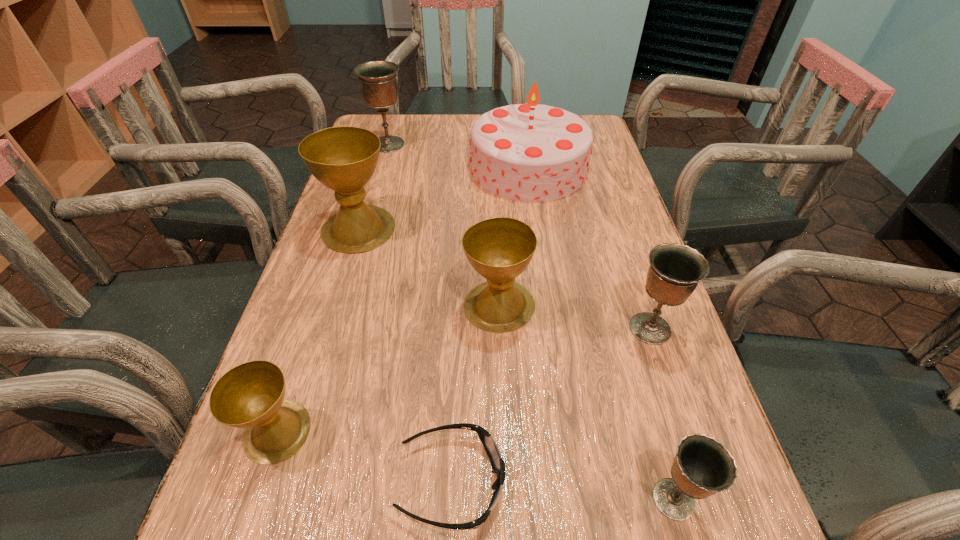
You are a GUI agent. You are given a task and a screenshot of the screen. Output one action in this format:
    pyautogui.click(x=<x>, y=<y>)
    Task: Click on the vacant point located between the sunglasses and the sixth nearest object
    
    Given the screenshot: What is the action you would take?
    pyautogui.click(x=405, y=355)

The width and height of the screenshot is (960, 540). Find the location of `free space between the biggest bronze chalice and the sunglasses`. free space between the biggest bronze chalice and the sunglasses is located at coordinates (420, 313).

Find the location of a particular element. The image size is (960, 540). free space between the birthday cake and the sixth nearest object is located at coordinates (444, 198).

You are a GUI agent. You are given a task and a screenshot of the screen. Output one action in this format:
    pyautogui.click(x=<x>, y=<y>)
    Task: Click on the free space between the smallest brown chalice and the second smallest bronze chalice
    The width and height of the screenshot is (960, 540).
    Given the screenshot: What is the action you would take?
    pyautogui.click(x=464, y=380)

The width and height of the screenshot is (960, 540). Find the location of `free space between the shortest object and the smallest brown chalice`. free space between the shortest object and the smallest brown chalice is located at coordinates (364, 456).

Locate an element on the screen. The image size is (960, 540). vacant point located between the second nearest brown chalice and the second farthest chalice is located at coordinates (429, 267).

This screenshot has height=540, width=960. Find the location of `unoccupied area between the second nearest bronze chalice and the nearest chalice`. unoccupied area between the second nearest bronze chalice and the nearest chalice is located at coordinates (661, 414).

Locate an element on the screen. This screenshot has height=540, width=960. free space between the shortest object and the second smallest brown chalice is located at coordinates (475, 394).

What are the coordinates of `empty space between the second biggest bronze chalice and the second smallest brown chalice` in the screenshot? It's located at [x=575, y=317].

The image size is (960, 540). I want to click on object identified as the closest to the birthday cake, so click(x=344, y=159).